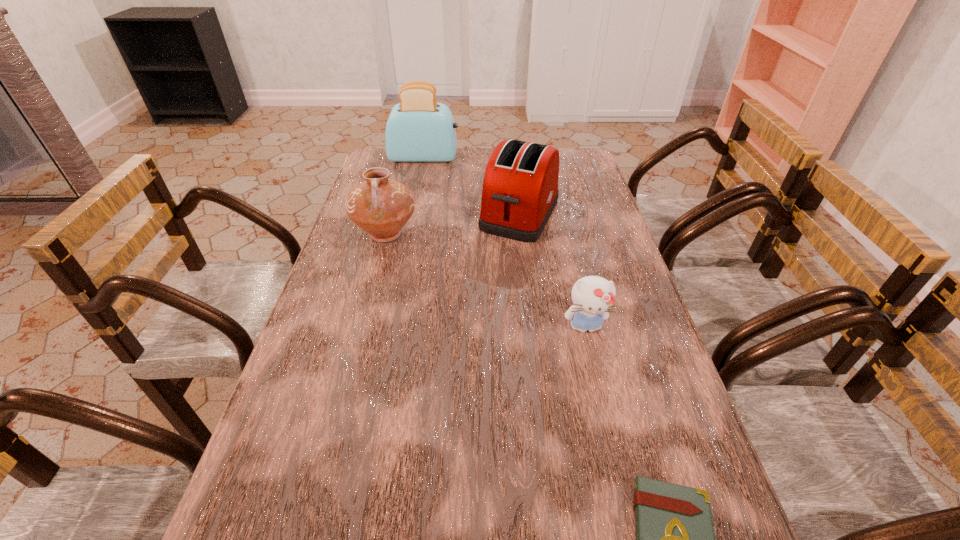
I want to click on free space in the image that satisfies the following two spatial constraints: 1. on the side of the left toaster with the lever; 2. on the left side of the shorter toaster, so click(x=413, y=214).

Where is `vacant position in the image that satisfies the following two spatial constraints: 1. on the back side of the shorter toaster; 2. on the side of the farthest object with the lever`? The image size is (960, 540). vacant position in the image that satisfies the following two spatial constraints: 1. on the back side of the shorter toaster; 2. on the side of the farthest object with the lever is located at coordinates (514, 158).

This screenshot has width=960, height=540. What are the coordinates of `vacant region that satisfies the following two spatial constraints: 1. on the side of the tallest object with the lever; 2. on the side of the pottery with the handle` in the screenshot? It's located at (409, 234).